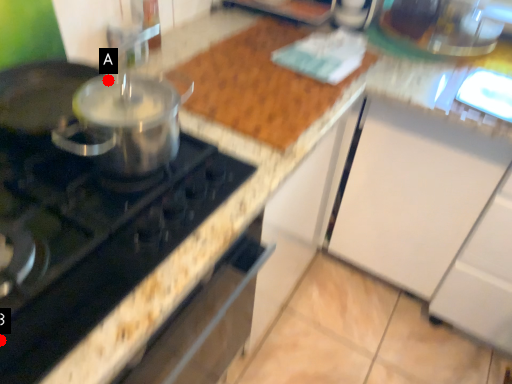
Question: Two points are circled on the image, labeled by A and B beside each circle. Which point is closer to the camera?

Choices:
 (A) A is closer
 (B) B is closer

Answer: (B)